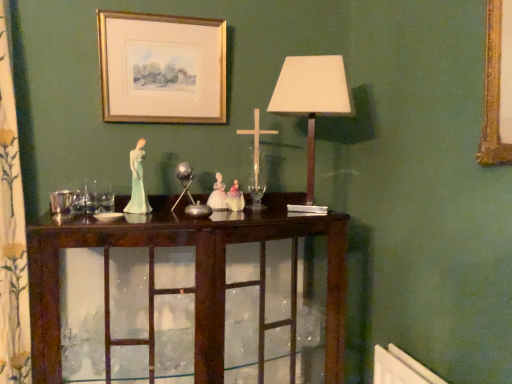
Question: Should I look upward or downward to see matte white lampshade at center?

Choices:
 (A) down
 (B) up

Answer: (B)

Question: From the image's perspective, would you say dark wood cabinet at center is shown under gold/glossy picture frame at upper center?

Choices:
 (A) yes
 (B) no

Answer: (A)

Question: Can you confirm if dark wood cabinet at center is smaller than gold/glossy picture frame at upper center?

Choices:
 (A) no
 (B) yes

Answer: (A)

Question: Does dark wood cabinet at center come behind gold/glossy picture frame at upper center?

Choices:
 (A) no
 (B) yes

Answer: (A)

Question: Does dark wood cabinet at center have a larger size compared to gold/glossy picture frame at upper center?

Choices:
 (A) yes
 (B) no

Answer: (A)

Question: Is dark wood cabinet at center to the left of gold/glossy picture frame at upper center from the viewer's perspective?

Choices:
 (A) no
 (B) yes

Answer: (A)

Question: Does dark wood cabinet at center have a greater height compared to gold/glossy picture frame at upper center?

Choices:
 (A) yes
 (B) no

Answer: (A)

Question: Is porcelain figure at center oriented away from dark wood cabinet at center?

Choices:
 (A) no
 (B) yes

Answer: (A)

Question: Does porcelain figure at center have a larger size compared to dark wood cabinet at center?

Choices:
 (A) no
 (B) yes

Answer: (A)

Question: From the image's perspective, is porcelain figure at center beneath dark wood cabinet at center?

Choices:
 (A) yes
 (B) no

Answer: (B)

Question: Is porcelain figure at center taller than dark wood cabinet at center?

Choices:
 (A) no
 (B) yes

Answer: (A)

Question: From a real-world perspective, is porcelain figure at center over dark wood cabinet at center?

Choices:
 (A) yes
 (B) no

Answer: (A)

Question: Can you confirm if porcelain figure at center is smaller than dark wood cabinet at center?

Choices:
 (A) yes
 (B) no

Answer: (A)

Question: Is dark wood cabinet at center oriented away from floral-patterned fabric at left?

Choices:
 (A) yes
 (B) no

Answer: (B)